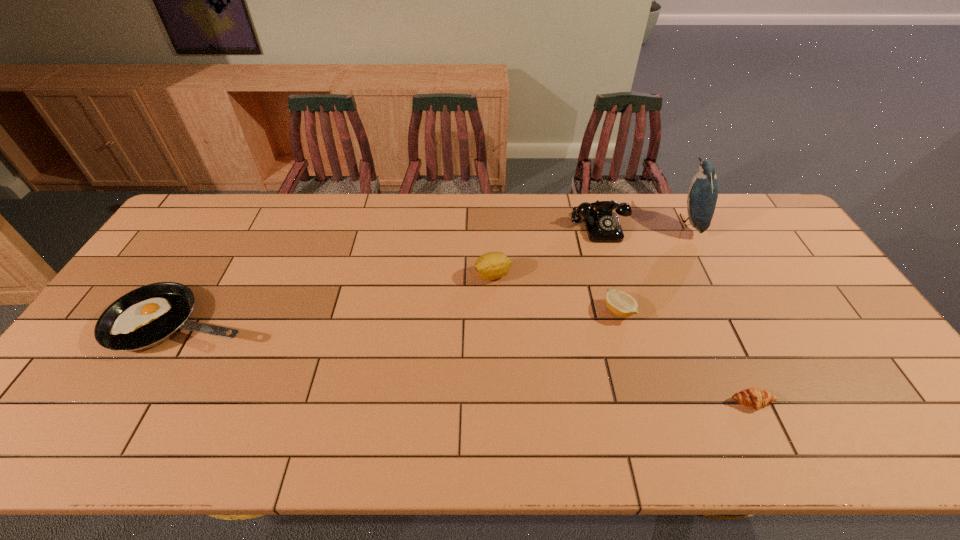
Locate an element on the screen. The height and width of the screenshot is (540, 960). bird is located at coordinates (703, 191).

The width and height of the screenshot is (960, 540). In order to click on telephone in this screenshot , I will do `click(602, 224)`.

The width and height of the screenshot is (960, 540). I want to click on the fifth object from right to left, so click(x=492, y=265).

This screenshot has height=540, width=960. Find the location of `the fourth nearest object`. the fourth nearest object is located at coordinates tap(492, 265).

Where is `the leftmost object`? This screenshot has width=960, height=540. the leftmost object is located at coordinates (145, 317).

I want to click on the nearer lemon, so pyautogui.click(x=621, y=304).

Identify the location of the shorter lemon. (621, 304).

At what (x,y) coordinates should I click in order to perform the action: click on the shortest object. Please return your answer as a coordinate pair (x, y). Looking at the image, I should click on (755, 398).

The height and width of the screenshot is (540, 960). What are the coordinates of `the nearest object` in the screenshot? It's located at [755, 398].

You are a GUI agent. You are given a task and a screenshot of the screen. Output one action in this format:
    pyautogui.click(x=<x>, y=<y>)
    Task: Click on the free location located at the tip of the tallest object's beak
    
    Given the screenshot: What is the action you would take?
    pyautogui.click(x=625, y=221)